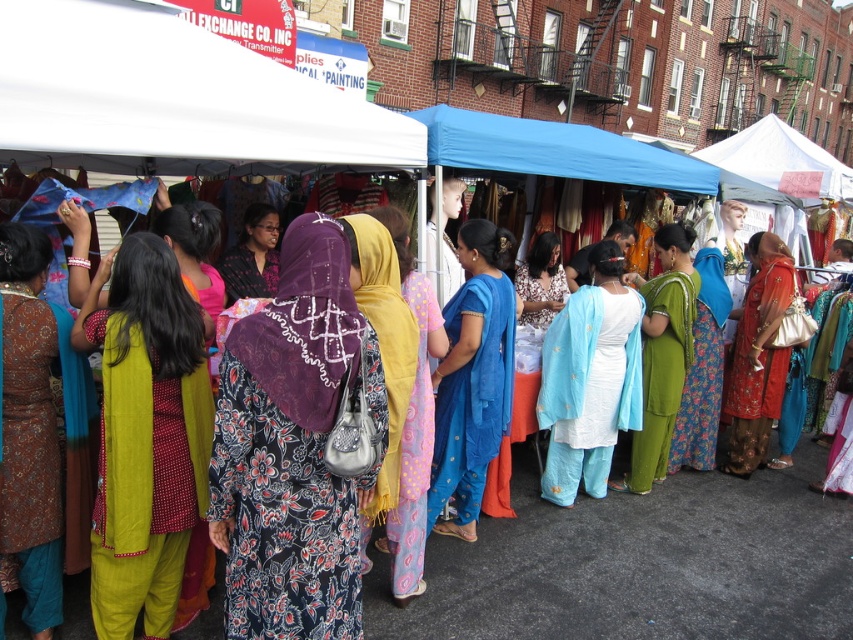
Question: Which point is farther from the camera taking this photo?

Choices:
 (A) (567, 481)
 (B) (247, 252)
 (C) (4, 401)

Answer: (B)

Question: Which is farther from the embroidered silk dress at center?

Choices:
 (A) blue silk saree at center
 (B) white fabric canopy at upper left

Answer: (B)

Question: Is white fabric canopy at upper left closer to camera compared to blue silk saree at center?

Choices:
 (A) yes
 (B) no

Answer: (A)

Question: Based on their relative distances, which object is nearer to the blue silk sari at center?

Choices:
 (A) matte green dress at center
 (B) blue silk saree at center
 (C) blue fabric canopy at center
 (D) floral-patterned dress at center

Answer: (D)

Question: Does white fabric canopy at upper left have a greater width compared to green silk sari at center?

Choices:
 (A) yes
 (B) no

Answer: (A)

Question: Is the position of blue silk sari at center more distant than that of matte black blouse at center?

Choices:
 (A) no
 (B) yes

Answer: (A)